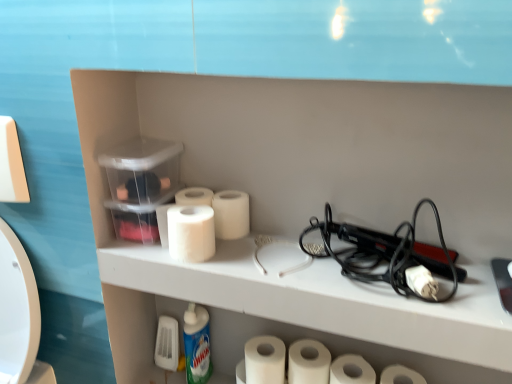
I want to click on vacant area on the back side of white matte toilet paper at center, placed as the 2th toilet paper when sorted from right to left, so click(367, 258).